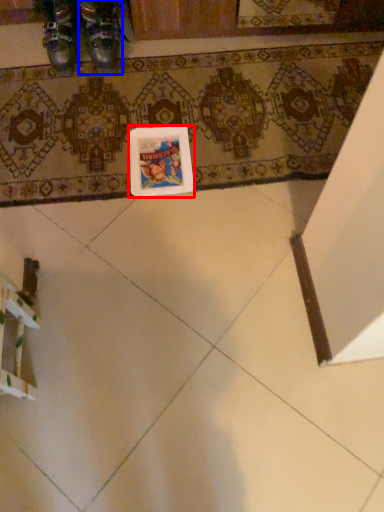
Question: Which point is further to the camera, postcard (highlighted by a red box) or footwear (highlighted by a blue box)?

Choices:
 (A) postcard
 (B) footwear

Answer: (B)